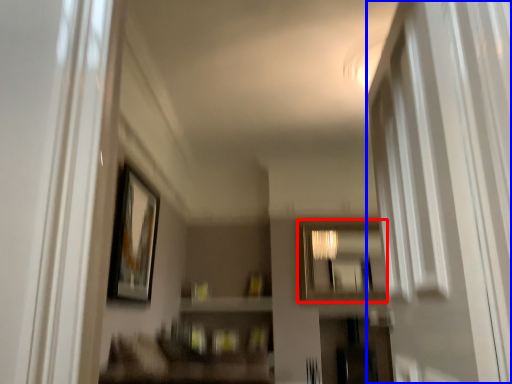
Question: Which point is further to the camera, mirror (highlighted by a red box) or screen door (highlighted by a blue box)?

Choices:
 (A) mirror
 (B) screen door

Answer: (A)